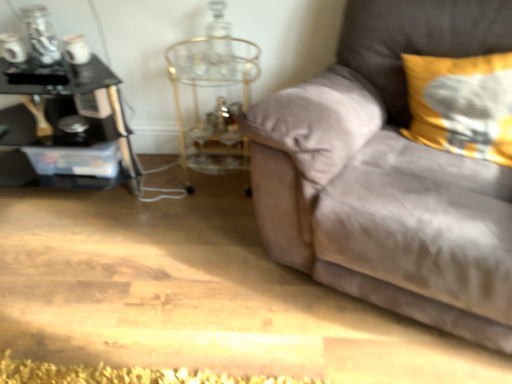
Question: Is yellow fabric pillow at upper right at the back of gold metallic side table at center?

Choices:
 (A) no
 (B) yes

Answer: (A)

Question: Is yellow fabric pillow at upper right inside gold metallic side table at center?

Choices:
 (A) yes
 (B) no

Answer: (B)

Question: From a real-world perspective, is gold metallic side table at center under yellow fabric pillow at upper right?

Choices:
 (A) yes
 (B) no

Answer: (A)

Question: Is gold metallic side table at center in contact with yellow fabric pillow at upper right?

Choices:
 (A) yes
 (B) no

Answer: (B)

Question: Can you confirm if gold metallic side table at center is wider than yellow fabric pillow at upper right?

Choices:
 (A) no
 (B) yes

Answer: (B)

Question: From a real-world perspective, is gold metallic side table at center located higher than yellow fabric pillow at upper right?

Choices:
 (A) no
 (B) yes

Answer: (A)

Question: From the image's perspective, is suede couch at right on black glass table at left?

Choices:
 (A) yes
 (B) no

Answer: (B)

Question: Is suede couch at right located outside black glass table at left?

Choices:
 (A) no
 (B) yes

Answer: (B)

Question: From the image's perspective, does suede couch at right appear lower than black glass table at left?

Choices:
 (A) no
 (B) yes

Answer: (B)

Question: Considering the relative sizes of suede couch at right and black glass table at left in the image provided, is suede couch at right smaller than black glass table at left?

Choices:
 (A) yes
 (B) no

Answer: (B)

Question: Is suede couch at right facing towards black glass table at left?

Choices:
 (A) yes
 (B) no

Answer: (B)

Question: From a real-world perspective, is suede couch at right on top of black glass table at left?

Choices:
 (A) no
 (B) yes

Answer: (B)

Question: Is yellow fabric pillow at upper right further to the viewer compared to black glass table at left?

Choices:
 (A) no
 (B) yes

Answer: (A)